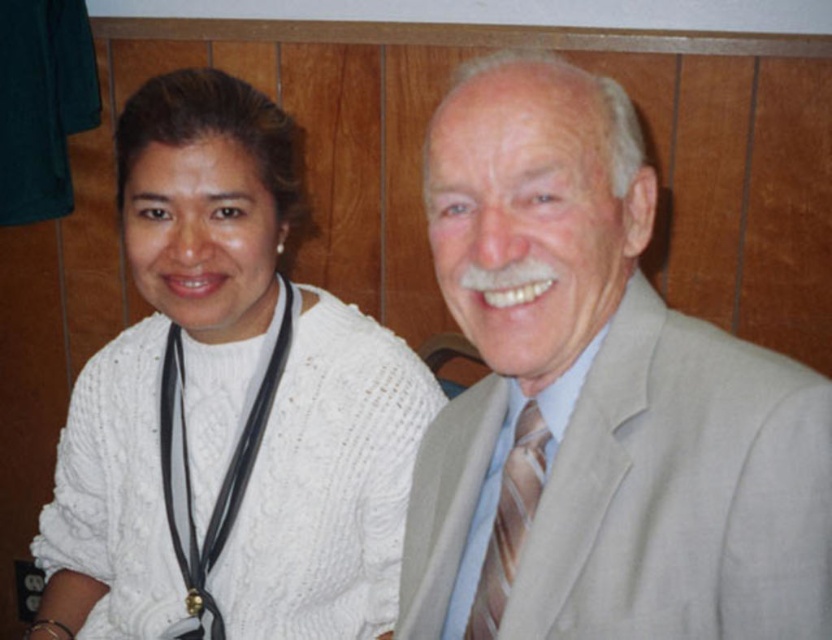
Between light beige suit at center and brown striped tie at center, which one is positioned lower?

brown striped tie at center is lower down.

Who is more distant from viewer, (593, 147) or (532, 420)?

Point (532, 420)

At what (x,y) coordinates should I click in order to perform the action: click on light beige suit at center. Please return your answer as a coordinate pair (x, y). Looking at the image, I should click on (597, 401).

This screenshot has height=640, width=832. Describe the element at coordinates (224, 474) in the screenshot. I see `black leather stethoscope at left` at that location.

Based on the photo, is black leather stethoscope at left to the left of brown striped tie at center from the viewer's perspective?

Correct, you'll find black leather stethoscope at left to the left of brown striped tie at center.

Who is more distant from viewer, (191, 568) or (509, 522)?

Positioned behind is point (191, 568).

Identify the location of black leather stethoscope at left. (224, 474).

Based on the photo, who is more forward, (558, 461) or (176, 244)?

Point (558, 461)

Who is shorter, light beige suit at center or white knitted sweater at left?

Standing shorter between the two is light beige suit at center.

The image size is (832, 640). Find the location of `light beige suit at center`. light beige suit at center is located at coordinates coord(597,401).